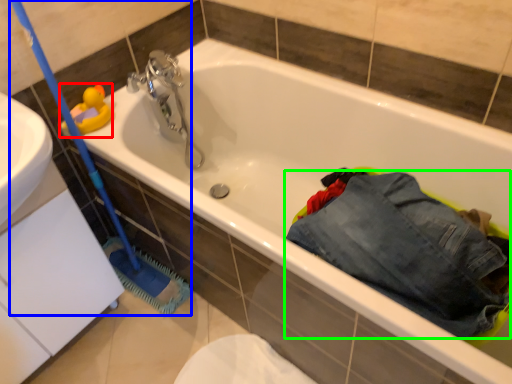
Question: Which is farther away from toy (highlighted by a red box)? brush (highlighted by a blue box) or trousers (highlighted by a green box)?

Choices:
 (A) brush
 (B) trousers

Answer: (B)